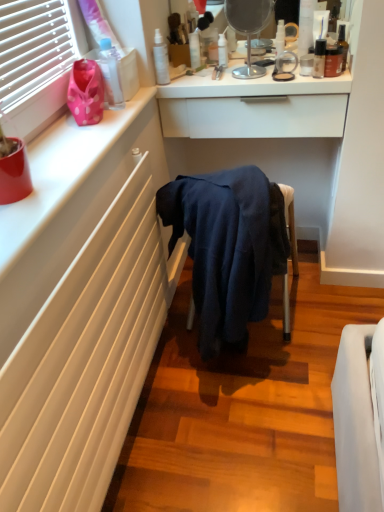
Locate an element on the screen. This screenshot has width=384, height=512. free space between satin white spray bottle at upper center, marked as the seventh toiletry in a right-to-left arrangement, and satin black bottle at upper right, the 3th toiletry from the right is located at coordinates (221, 82).